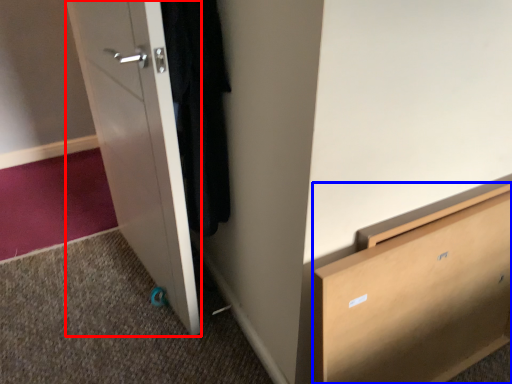
Question: Which of the following is the farthest to the observer, door (highlighted by a red box) or chest of drawers (highlighted by a blue box)?

Choices:
 (A) door
 (B) chest of drawers

Answer: (A)